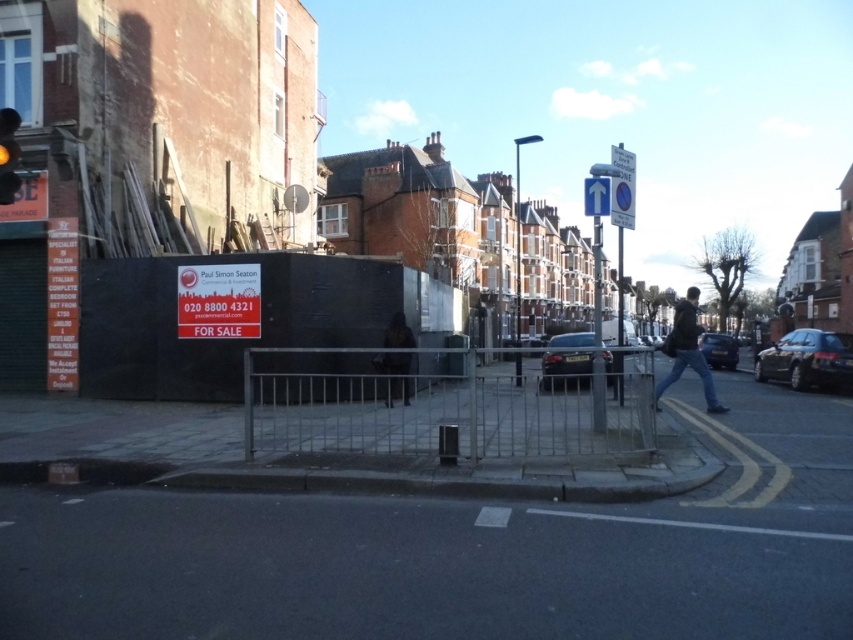
From the picture: You are standing on the sidewalk and want to walk towards the silver metallic fence at center. In which direction should you walk?

The silver metallic fence at center is located at point (438, 404), which is in the central area of the image. Since you are on the sidewalk, you should walk straight ahead towards the center of the scene to reach the silver metallic fence at center.

You are a pedestrian standing on the sidewalk looking towards the road. You see a dark gray jacket at center right and a red glass traffic light at upper left. Which object is closer to your eye level?

The dark gray jacket at center right is below the red glass traffic light at upper left, so the red glass traffic light at upper left is closer to your eye level.